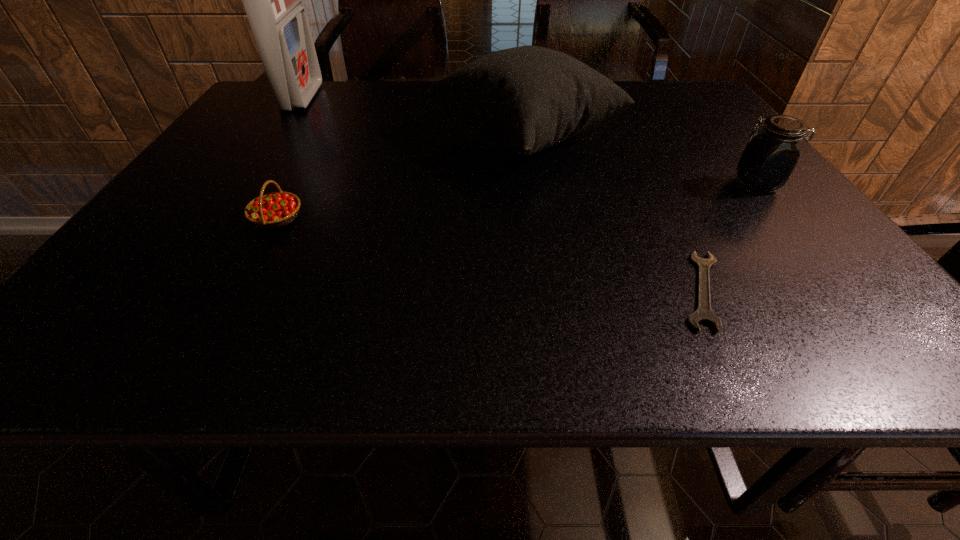
Locate an element on the screen. Image resolution: width=960 pixels, height=540 pixels. the first-aid kit is located at coordinates (272, 0).

Find the location of a particular element. The width and height of the screenshot is (960, 540). the tallest object is located at coordinates (272, 0).

At what (x,y) coordinates should I click in order to perform the action: click on the second tallest object. Please return your answer as a coordinate pair (x, y). This screenshot has width=960, height=540. Looking at the image, I should click on (527, 98).

The width and height of the screenshot is (960, 540). In order to click on the third tallest object in this screenshot , I will do `click(770, 156)`.

Find the location of `the rightmost object`. the rightmost object is located at coordinates (770, 156).

At what (x,y) coordinates should I click in order to perform the action: click on the fourth farthest object. Please return your answer as a coordinate pair (x, y). The image size is (960, 540). Looking at the image, I should click on (273, 210).

What are the coordinates of `strawberry` in the screenshot? It's located at (273, 210).

This screenshot has height=540, width=960. I want to click on the shortest object, so [x=703, y=313].

This screenshot has width=960, height=540. I want to click on wrench, so click(x=703, y=313).

At what (x,y) coordinates should I click in order to perform the action: click on vacant space located on the front-facing side of the first-aid kit. Please return your answer as a coordinate pair (x, y). This screenshot has width=960, height=540. Looking at the image, I should click on (363, 98).